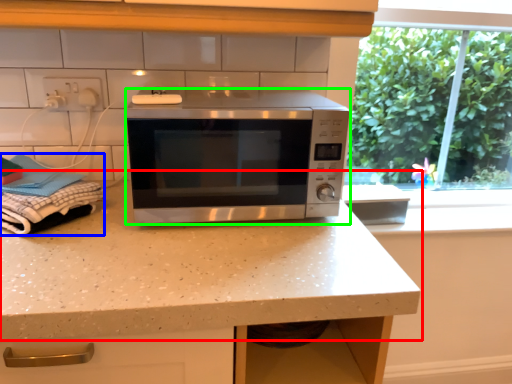
Question: Which is farther away from countertop (highlighted by a red box)? laundry (highlighted by a blue box) or microwave oven (highlighted by a green box)?

Choices:
 (A) laundry
 (B) microwave oven

Answer: (A)